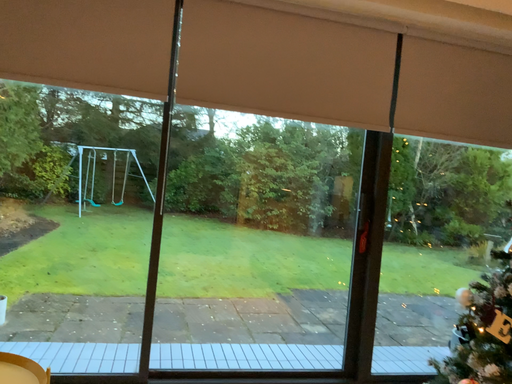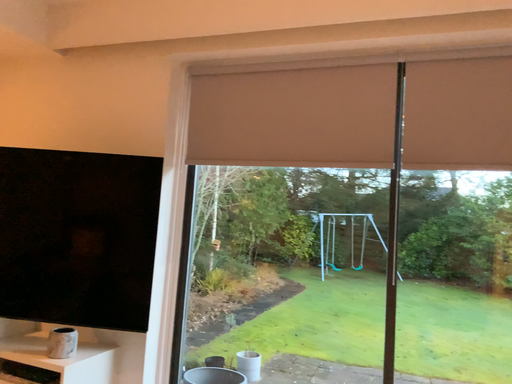
Question: How did the camera likely rotate when shooting the video?

Choices:
 (A) rotated right
 (B) rotated left

Answer: (B)